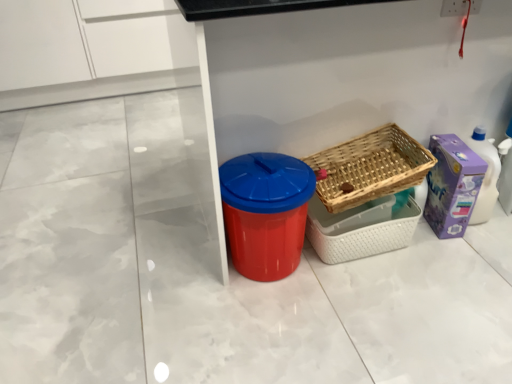
Question: From a real-world perspective, is red plastic bin at center over purple cardboard box at right?

Choices:
 (A) yes
 (B) no

Answer: (A)

Question: Is red plastic bin at center far from purple cardboard box at right?

Choices:
 (A) no
 (B) yes

Answer: (A)

Question: Is red plastic bin at center beside purple cardboard box at right?

Choices:
 (A) yes
 (B) no

Answer: (B)

Question: Is the position of red plastic bin at center more distant than that of purple cardboard box at right?

Choices:
 (A) no
 (B) yes

Answer: (A)

Question: Is purple cardboard box at right inside red plastic bin at center?

Choices:
 (A) yes
 (B) no

Answer: (B)

Question: Is the depth of red plastic bin at center less than that of purple cardboard box at right?

Choices:
 (A) yes
 (B) no

Answer: (A)

Question: Is purple cardboard box at right facing towards woven wood basket at center right, which appears as the first basket when ordered from the bottom?

Choices:
 (A) yes
 (B) no

Answer: (B)

Question: Is woven wood basket at center right, marked as the second basket in a top-to-bottom arrangement, completely or partially inside purple cardboard box at right?

Choices:
 (A) yes
 (B) no

Answer: (B)

Question: Does purple cardboard box at right have a greater width compared to woven wood basket at center right, which appears as the first basket when ordered from the bottom?

Choices:
 (A) no
 (B) yes

Answer: (B)

Question: Can you confirm if purple cardboard box at right is bigger than woven wood basket at center right, which appears as the first basket when ordered from the bottom?

Choices:
 (A) no
 (B) yes

Answer: (A)

Question: Is purple cardboard box at right smaller than woven wood basket at center right, which appears as the first basket when ordered from the bottom?

Choices:
 (A) no
 (B) yes

Answer: (B)

Question: Does purple cardboard box at right appear on the left side of woven wood basket at center right, marked as the second basket in a top-to-bottom arrangement?

Choices:
 (A) yes
 (B) no

Answer: (B)

Question: Is woven wood basket at center right, marked as the second basket in a top-to-bottom arrangement, aimed at red plastic bin at center?

Choices:
 (A) yes
 (B) no

Answer: (B)